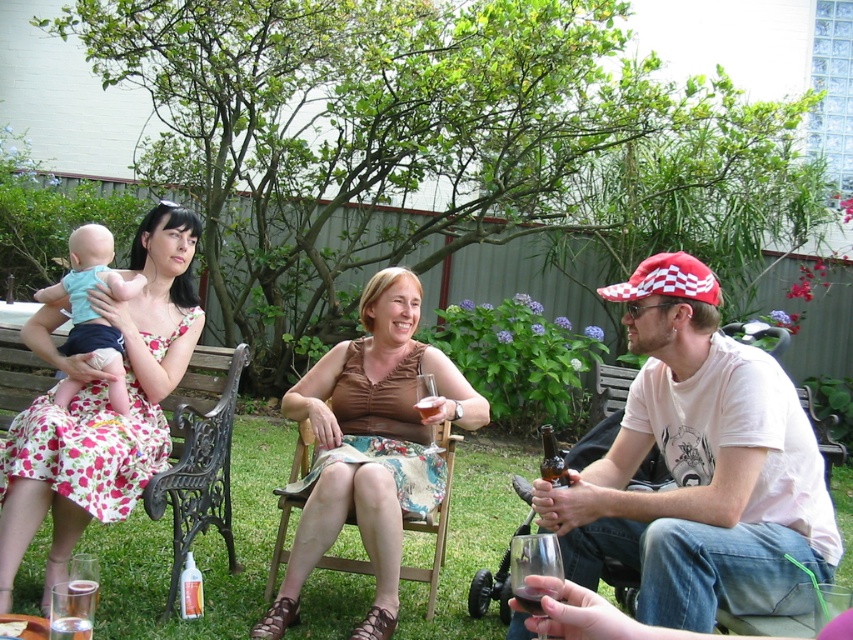
Consider the image. Measure the distance between translucent glass wine at lower center and translucent glass beer at center.

translucent glass wine at lower center is 1.39 meters away from translucent glass beer at center.

Which is below, translucent glass wine at lower center or translucent glass beer at center?

translucent glass wine at lower center is below.

Does point (535, 612) come in front of point (437, 412)?

Yes, point (535, 612) is closer to viewer.

You are a GUI agent. You are given a task and a screenshot of the screen. Output one action in this format:
    pyautogui.click(x=<x>, y=<y>)
    Task: Click on the translucent glass wine at lower center
    
    Given the screenshot: What is the action you would take?
    pyautogui.click(x=529, y=598)

Between matte brown dress at center and translucent glass beer at center, which one is positioned higher?

translucent glass beer at center is higher up.

Can you confirm if matte brown dress at center is positioned to the left of translucent glass beer at center?

Correct, you'll find matte brown dress at center to the left of translucent glass beer at center.

Is point (117, 588) positioned after point (434, 401)?

Yes, point (117, 588) is behind point (434, 401).

Where is `matte brown dress at center`? matte brown dress at center is located at coordinates (196, 547).

Between brown satin blouse at center and translucent glass beer at center, which one appears on the left side from the viewer's perspective?

Positioned to the left is brown satin blouse at center.

Find the location of `brown satin blouse at center`. brown satin blouse at center is located at coordinates (369, 448).

Find the location of a particular element. The width and height of the screenshot is (853, 640). brown satin blouse at center is located at coordinates (369, 448).